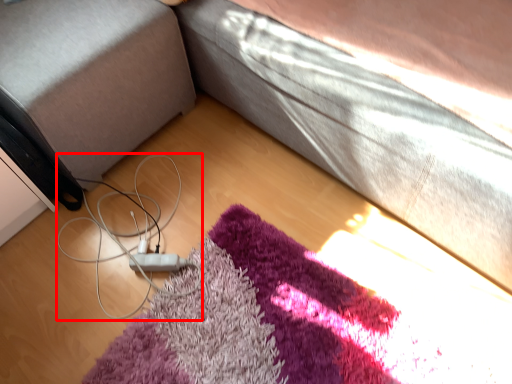
Question: Where is cable (annotated by the red box) located in relation to gray in the image?

Choices:
 (A) left
 (B) right

Answer: (B)